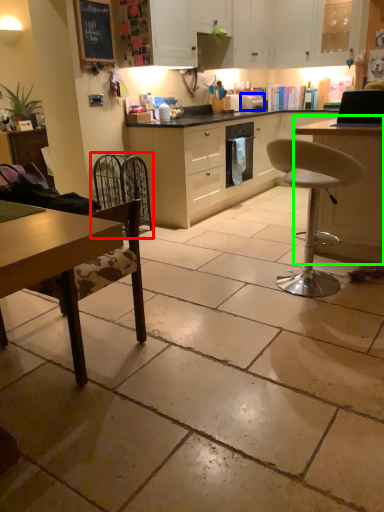
Question: Estimate the real-world distances between objects in this image. Which object is farther from swivel chair (highlighted by a red box), appliance (highlighted by a blue box) or table (highlighted by a green box)?

Choices:
 (A) appliance
 (B) table

Answer: (B)